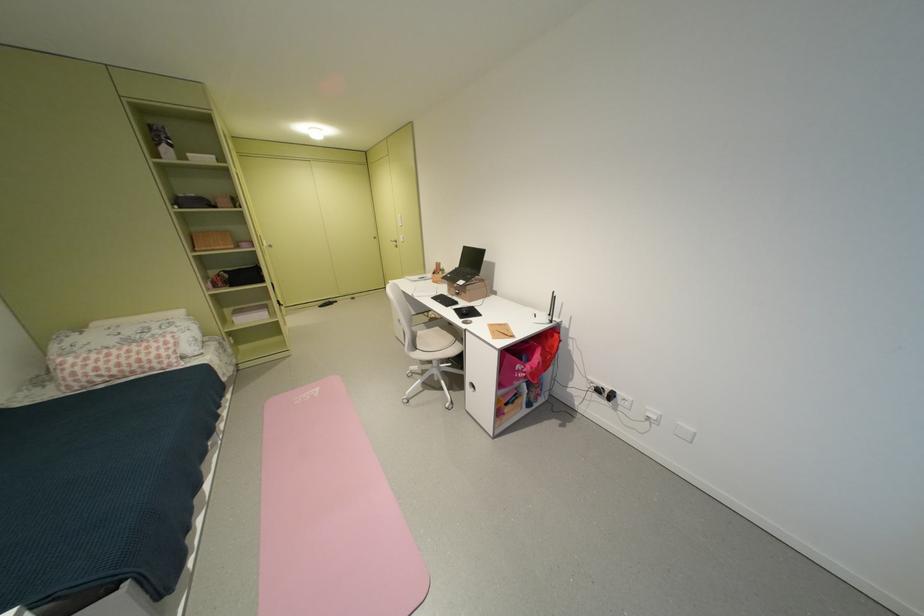
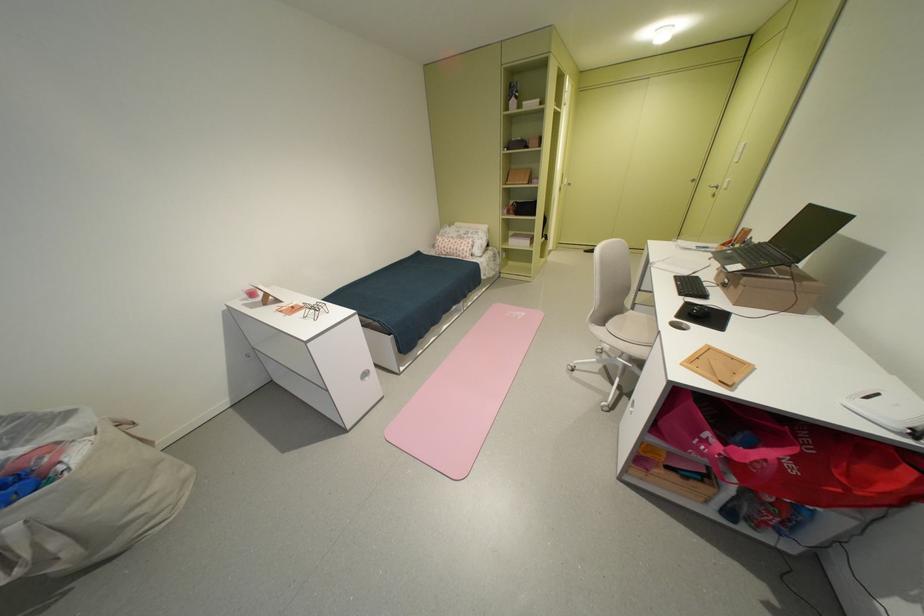
The point at (511, 326) is marked in the first image. Where is the corresponding point in the second image?

(743, 360)